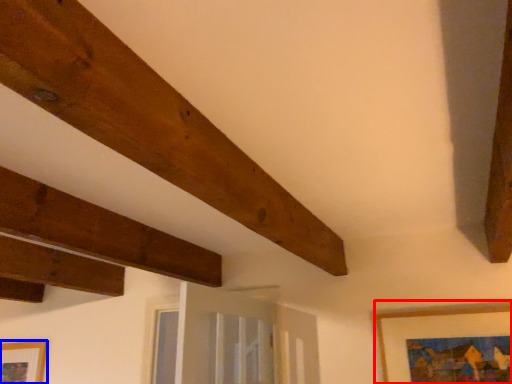
Question: Which of the following is the closest to the observer, picture frame (highlighted by a red box) or picture frame (highlighted by a blue box)?

Choices:
 (A) picture frame
 (B) picture frame

Answer: (A)